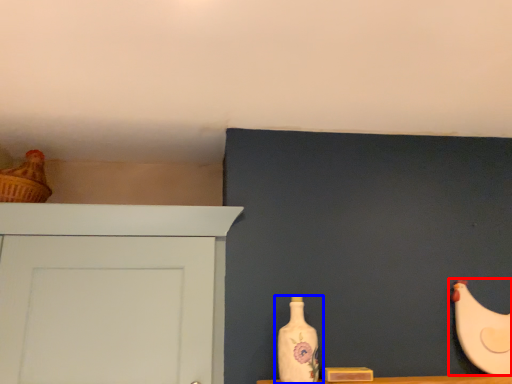
Question: Which point is closer to the camera, chicken (highlighted by a red box) or bottle (highlighted by a blue box)?

Choices:
 (A) chicken
 (B) bottle

Answer: (B)